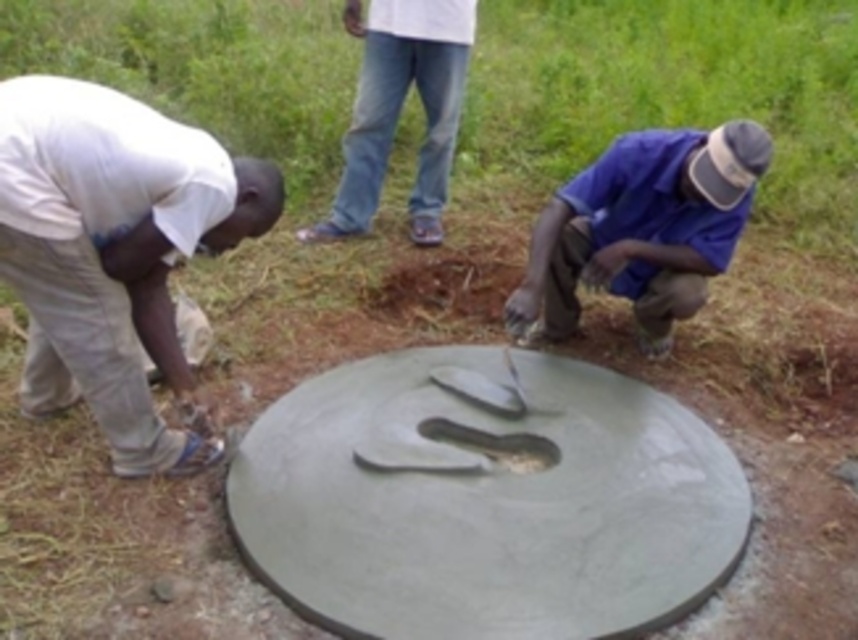
You are standing at the origin point of the coordinate system in the image. Where is the white matte shirt at left located?

The white matte shirt at left is located at the coordinate point of (113, 252).

You are standing at the center of the image. Which direction should you move to reach the blue matte shirt at right?

The blue matte shirt at right is located at point 0.356 on the x axis and 0.749 on the y axis. Since you are at the center, moving towards the right and slightly upwards would reach it.

You are a construction inspector who needs to check the alignment of the gray concrete manhole at center and the blue matte shirt at right. Based on the scene, which object is located to the right of the other?

The gray concrete manhole at center is positioned on the left side of blue matte shirt at right, so the blue matte shirt at right is to the right of the gray concrete manhole at center.